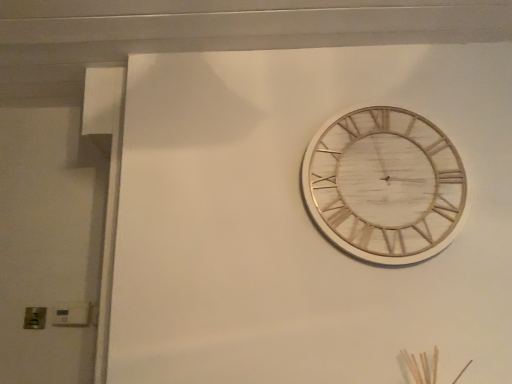
Measure the distance between point (377,192) and camera.

Point (377,192) is 4.88 feet from camera.

Describe the element at coordinates (384, 185) in the screenshot. The image size is (512, 384). I see `white wood clock at upper right` at that location.

Identify the location of white wood clock at upper right. click(x=384, y=185).

At what (x,y) coordinates should I click in order to perform the action: click on white wood clock at upper right. Please return your answer as a coordinate pair (x, y). Looking at the image, I should click on (384, 185).